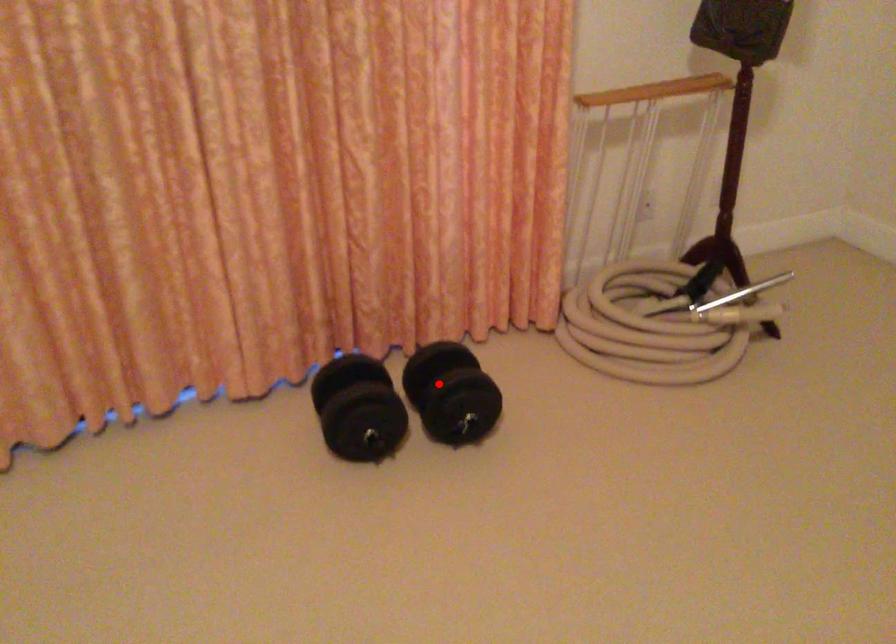
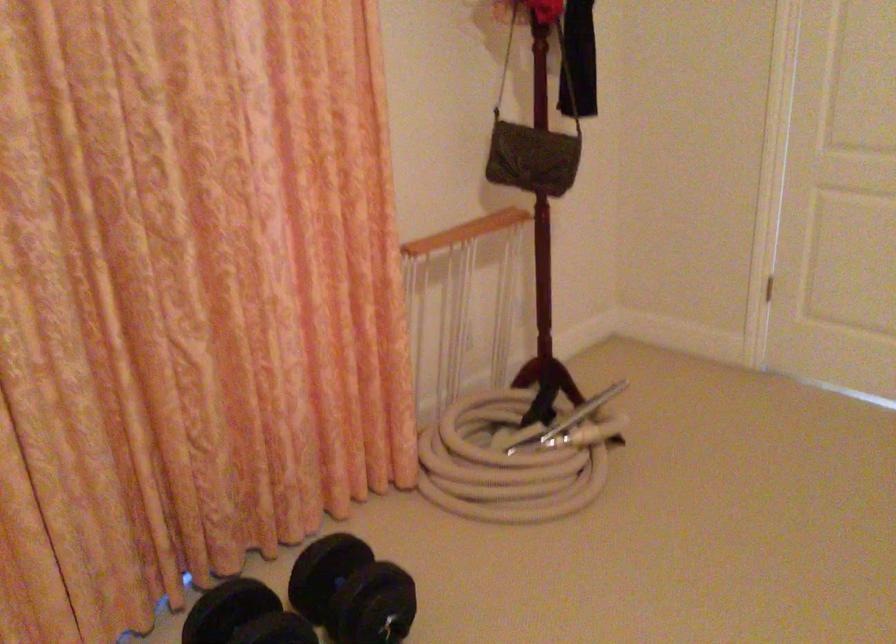
Question: I am providing you with two images of the same scene from different viewpoints. A red point is marked on the first image. Is the red point's position out of view in image 2?

Choices:
 (A) Yes
 (B) No

Answer: (B)